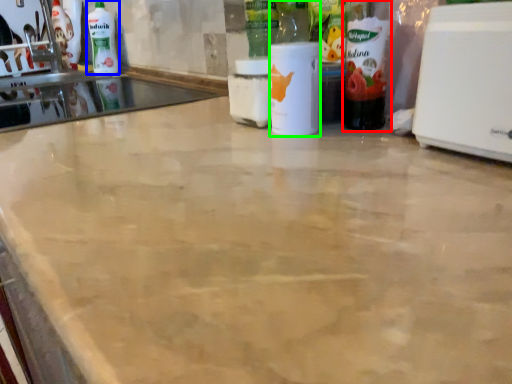
Question: Estimate the real-world distances between objects in this image. Which object is closer to bottle (highlighted by a red box), cleaning product (highlighted by a blue box) or bottle (highlighted by a green box)?

Choices:
 (A) cleaning product
 (B) bottle

Answer: (B)